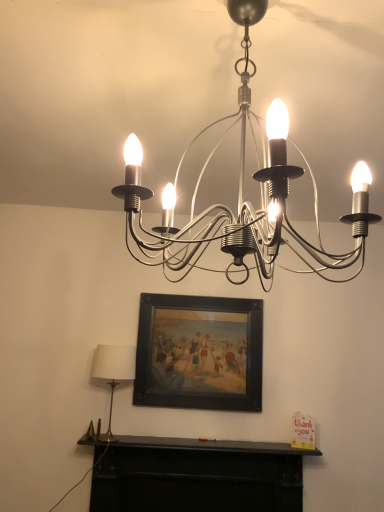
How much space does satin silver chandelier at upper center, acting as the second lamp starting from the back, occupy vertically?

69.68 centimeters.

Describe the element at coordinates (113, 372) in the screenshot. I see `white fabric lampshade at left, the first lamp viewed from the left` at that location.

This screenshot has height=512, width=384. Identify the location of satin silver chandelier at upper center, marked as the 1th lamp in a right-to-left arrangement. (242, 192).

How far apart are black matte fireplace at lower center and white fabric lampshade at left, the first lamp viewed from the left?

black matte fireplace at lower center and white fabric lampshade at left, the first lamp viewed from the left, are 49.71 centimeters apart from each other.

Considering the relative positions of black matte fireplace at lower center and white fabric lampshade at left, which appears as the first lamp when ordered from the bottom, in the image provided, is black matte fireplace at lower center to the left or to the right of white fabric lampshade at left, which appears as the first lamp when ordered from the bottom,?

In the image, black matte fireplace at lower center appears on the right side of white fabric lampshade at left, which appears as the first lamp when ordered from the bottom.

In the scene shown: From a real-world perspective, is black matte fireplace at lower center physically located above or below white fabric lampshade at left, the first lamp viewed from the left?

black matte fireplace at lower center is below white fabric lampshade at left, the first lamp viewed from the left.

Is white fabric lampshade at left, the 1th lamp viewed from the back, inside black matte fireplace at lower center?

Definitely not — white fabric lampshade at left, the 1th lamp viewed from the back, is not inside black matte fireplace at lower center.

Which is more to the right, satin silver chandelier at upper center, which is counted as the 2th lamp, starting from the left, or black matte fireplace at lower center?

satin silver chandelier at upper center, which is counted as the 2th lamp, starting from the left.

Identify the location of furniture on the left of satin silver chandelier at upper center, arranged as the first lamp when viewed from the front. This screenshot has width=384, height=512. (195, 475).

What's the angular difference between satin silver chandelier at upper center, acting as the second lamp starting from the back, and black matte fireplace at lower center's facing directions?

The angular difference between satin silver chandelier at upper center, acting as the second lamp starting from the back, and black matte fireplace at lower center is 90.4 degrees.

Considering the relative sizes of satin silver chandelier at upper center, acting as the second lamp starting from the back, and black matte fireplace at lower center in the image provided, is satin silver chandelier at upper center, acting as the second lamp starting from the back, bigger than black matte fireplace at lower center?

Yes, satin silver chandelier at upper center, acting as the second lamp starting from the back, is bigger than black matte fireplace at lower center.

Which is less distant, (274, 148) or (197, 369)?

Point (274, 148) is closer to the camera than point (197, 369).

Between satin silver chandelier at upper center, placed as the 1th lamp when sorted from top to bottom, and black wooden picture frame at center, which one appears on the right side from the viewer's perspective?

satin silver chandelier at upper center, placed as the 1th lamp when sorted from top to bottom, is more to the right.

Is there a large distance between satin silver chandelier at upper center, the 2th lamp in the bottom-to-top sequence, and black wooden picture frame at center?

A: That's right, there is a large distance between satin silver chandelier at upper center, the 2th lamp in the bottom-to-top sequence, and black wooden picture frame at center.

Can we say black wooden picture frame at center lies outside white fabric lampshade at left, acting as the 2th lamp starting from the front?

black wooden picture frame at center lies outside white fabric lampshade at left, acting as the 2th lamp starting from the front,'s area.

Which of these two, black wooden picture frame at center or white fabric lampshade at left, arranged as the second lamp when viewed from the top, is bigger?

With larger size is black wooden picture frame at center.

You are a GUI agent. You are given a task and a screenshot of the screen. Output one action in this format:
    pyautogui.click(x=<x>, y=<y>)
    Task: Click on the lamp located underneath the black wooden picture frame at center (from a real-world perspective)
    The image size is (384, 512).
    Given the screenshot: What is the action you would take?
    pyautogui.click(x=113, y=372)

Is point (218, 303) positioned in front of point (108, 356)?

No, (218, 303) is further to viewer.

From the image's perspective, would you say black matte fireplace at lower center is shown under satin silver chandelier at upper center, the 2th lamp in the bottom-to-top sequence?

Yes, from the image's perspective, black matte fireplace at lower center is beneath satin silver chandelier at upper center, the 2th lamp in the bottom-to-top sequence.

Does black matte fireplace at lower center have a lesser width compared to satin silver chandelier at upper center, which is counted as the 2th lamp, starting from the left?

Correct, the width of black matte fireplace at lower center is less than that of satin silver chandelier at upper center, which is counted as the 2th lamp, starting from the left.

Is black matte fireplace at lower center bigger or smaller than satin silver chandelier at upper center, which is counted as the 2th lamp, starting from the left?

black matte fireplace at lower center is smaller than satin silver chandelier at upper center, which is counted as the 2th lamp, starting from the left.

Considering the sizes of white fabric lampshade at left, the 1th lamp viewed from the back, and satin silver chandelier at upper center, which is counted as the 2th lamp, starting from the left, in the image, is white fabric lampshade at left, the 1th lamp viewed from the back, bigger or smaller than satin silver chandelier at upper center, which is counted as the 2th lamp, starting from the left,?

Considering their sizes, white fabric lampshade at left, the 1th lamp viewed from the back, takes up less space than satin silver chandelier at upper center, which is counted as the 2th lamp, starting from the left.

Could satin silver chandelier at upper center, acting as the second lamp starting from the back, be considered to be inside white fabric lampshade at left, the 1th lamp viewed from the back?

No, white fabric lampshade at left, the 1th lamp viewed from the back, does not contain satin silver chandelier at upper center, acting as the second lamp starting from the back.

Which object is wider, white fabric lampshade at left, acting as the 2th lamp starting from the front, or satin silver chandelier at upper center, the 2th lamp in the bottom-to-top sequence?

Wider between the two is satin silver chandelier at upper center, the 2th lamp in the bottom-to-top sequence.

From the picture: Is there a large distance between white fabric lampshade at left, the 1th lamp viewed from the back, and satin silver chandelier at upper center, marked as the 1th lamp in a right-to-left arrangement?

white fabric lampshade at left, the 1th lamp viewed from the back, is positioned a significant distance from satin silver chandelier at upper center, marked as the 1th lamp in a right-to-left arrangement.

The width and height of the screenshot is (384, 512). Identify the location of picture frame on the right side of black matte fireplace at lower center. (199, 353).

Between black wooden picture frame at center and black matte fireplace at lower center, which one has larger size?

Bigger between the two is black matte fireplace at lower center.

Is black wooden picture frame at center not near black matte fireplace at lower center?

They are positioned close to each other.

Measure the distance from black wooden picture frame at center to black matte fireplace at lower center.

They are 48.13 centimeters apart.

This screenshot has width=384, height=512. In the image, there is a white fabric lampshade at left, acting as the 2th lamp starting from the front. Identify the location of furniture below it (from the image's perspective). (195, 475).

The height and width of the screenshot is (512, 384). Identify the location of furniture that is behind the satin silver chandelier at upper center, arranged as the first lamp when viewed from the front. (195, 475).

From the picture: Which object lies further to the anchor point white fabric lampshade at left, arranged as the 2th lamp when viewed from the right, satin silver chandelier at upper center, which is counted as the 2th lamp, starting from the left, or black matte fireplace at lower center?

satin silver chandelier at upper center, which is counted as the 2th lamp, starting from the left.

Looking at the image, which one is located further to black matte fireplace at lower center, white fabric lampshade at left, which appears as the first lamp when ordered from the bottom, or black wooden picture frame at center?

Among the two, white fabric lampshade at left, which appears as the first lamp when ordered from the bottom, is located further to black matte fireplace at lower center.

Considering their positions, is black wooden picture frame at center positioned closer to satin silver chandelier at upper center, the 2th lamp in the bottom-to-top sequence, than black matte fireplace at lower center?

The object closer to satin silver chandelier at upper center, the 2th lamp in the bottom-to-top sequence, is black wooden picture frame at center.

Looking at the image, which one is located further to black wooden picture frame at center, satin silver chandelier at upper center, arranged as the first lamp when viewed from the front, or white fabric lampshade at left, acting as the 2th lamp starting from the front?

satin silver chandelier at upper center, arranged as the first lamp when viewed from the front, is positioned further to the anchor black wooden picture frame at center.

Considering their positions, is white fabric lampshade at left, arranged as the second lamp when viewed from the top, positioned closer to black wooden picture frame at center than satin silver chandelier at upper center, which is counted as the 2th lamp, starting from the left?

white fabric lampshade at left, arranged as the second lamp when viewed from the top, lies closer to black wooden picture frame at center than the other object.

Consider the image. Based on their spatial positions, is black matte fireplace at lower center or black wooden picture frame at center further from white fabric lampshade at left, acting as the 2th lamp starting from the front?

black matte fireplace at lower center is further to white fabric lampshade at left, acting as the 2th lamp starting from the front.

When comparing their distances from satin silver chandelier at upper center, the 2th lamp in the bottom-to-top sequence, does white fabric lampshade at left, arranged as the second lamp when viewed from the top, or black wooden picture frame at center seem closer?

black wooden picture frame at center lies closer to satin silver chandelier at upper center, the 2th lamp in the bottom-to-top sequence, than the other object.

Looking at the image, which one is located closer to black matte fireplace at lower center, white fabric lampshade at left, the first lamp viewed from the left, or satin silver chandelier at upper center, the 2th lamp in the bottom-to-top sequence?

white fabric lampshade at left, the first lamp viewed from the left, is closer to black matte fireplace at lower center.

Find the location of a particular element. The image size is (384, 512). lamp located between satin silver chandelier at upper center, placed as the 1th lamp when sorted from top to bottom, and black matte fireplace at lower center in the depth direction is located at coordinates tap(113, 372).

The image size is (384, 512). In order to click on lamp between black wooden picture frame at center and black matte fireplace at lower center vertically in this screenshot , I will do `click(113, 372)`.

At what (x,y) coordinates should I click in order to perform the action: click on lamp between satin silver chandelier at upper center, placed as the 1th lamp when sorted from top to bottom, and black wooden picture frame at center from front to back. Please return your answer as a coordinate pair (x, y). The image size is (384, 512). Looking at the image, I should click on (113, 372).

Find the location of a particular element. furniture between satin silver chandelier at upper center, which is counted as the 2th lamp, starting from the left, and black wooden picture frame at center in the front-back direction is located at coordinates (195, 475).